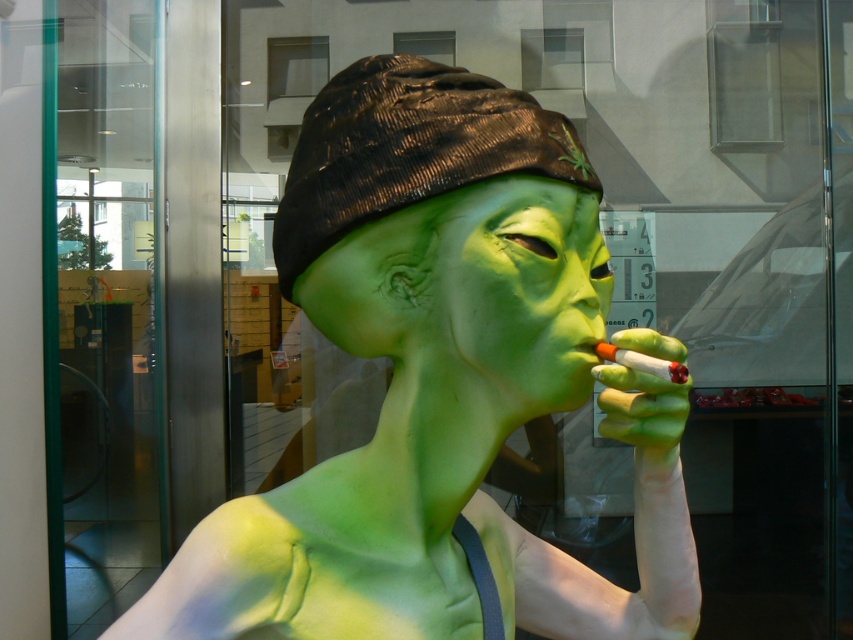
Question: Which of the following is the closest to the observer?

Choices:
 (A) [114, 131]
 (B) [497, 234]
 (C) [289, 188]

Answer: (B)

Question: From the image, what is the correct spatial relationship of matte green alien at center in relation to transparent glass door at left?

Choices:
 (A) above
 (B) below

Answer: (A)

Question: Which point is farther to the camera?

Choices:
 (A) matte green alien at center
 (B) black textured beanie at upper center
 (C) transparent glass door at left
 (D) green matte mask at center

Answer: (C)

Question: Does transparent glass door at left come in front of green matte mask at center?

Choices:
 (A) yes
 (B) no

Answer: (B)

Question: Which point appears farthest from the camera in this image?

Choices:
 (A) (303, 218)
 (B) (82, 77)

Answer: (B)

Question: Can you confirm if matte green alien at center is positioned above green matte mask at center?

Choices:
 (A) yes
 (B) no

Answer: (B)